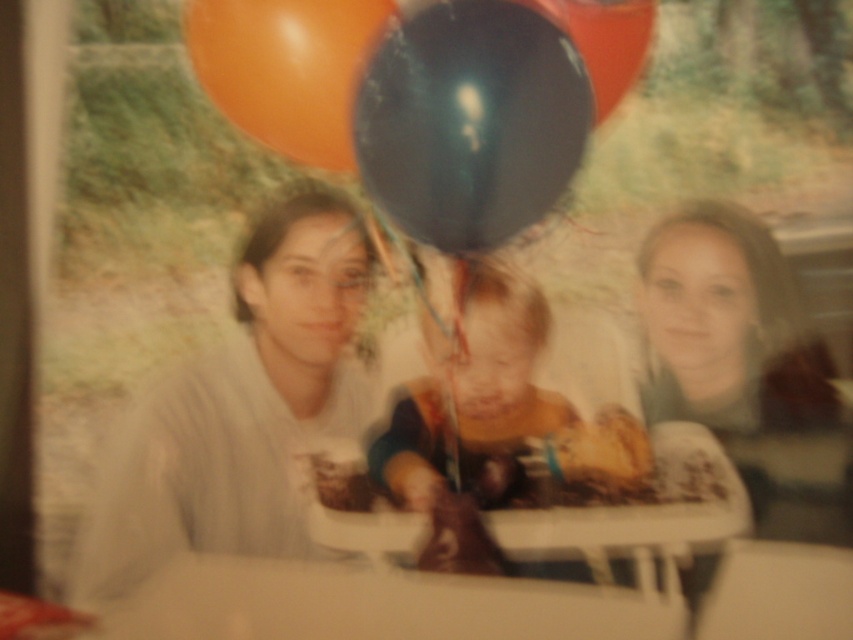
You are a photographer who needs to adjust the lighting for a closeup shot of the black rubber balloon at upper center and the matte gray sweater at upper right. Since the balloon is shorter than the sweater, where should you position the light source to ensure both objects are evenly illuminated?

The black rubber balloon at upper center is shorter than the matte gray sweater at upper right. To ensure both are evenly illuminated, position the light source above and slightly behind the sweater so the light can reach both the shorter balloon and the taller sweater adequately.

You are a photographer trying to capture a closeup of the black rubber balloon at upper center without including the child in the frame. Given that the camera can focus on objects within a 3 feet range, is this possible?

The black rubber balloon at upper center is 4.31 feet away from the child. Since the camera can only focus within 3 feet, capturing a closeup of the black rubber balloon at upper center without including the child would require moving closer to the balloon, but since they are 4.31 feet apart, it might not be possible to get close enough without the child being in the frame.